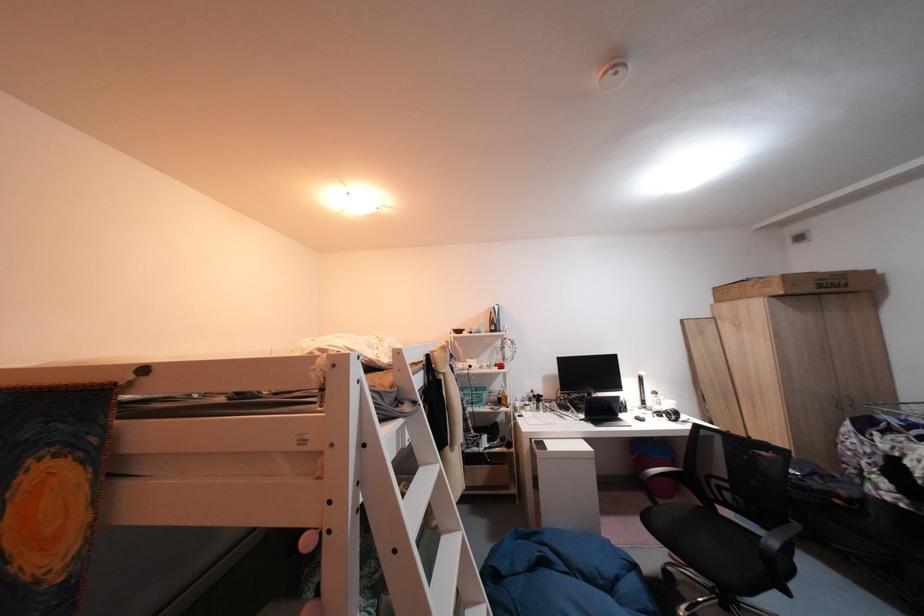
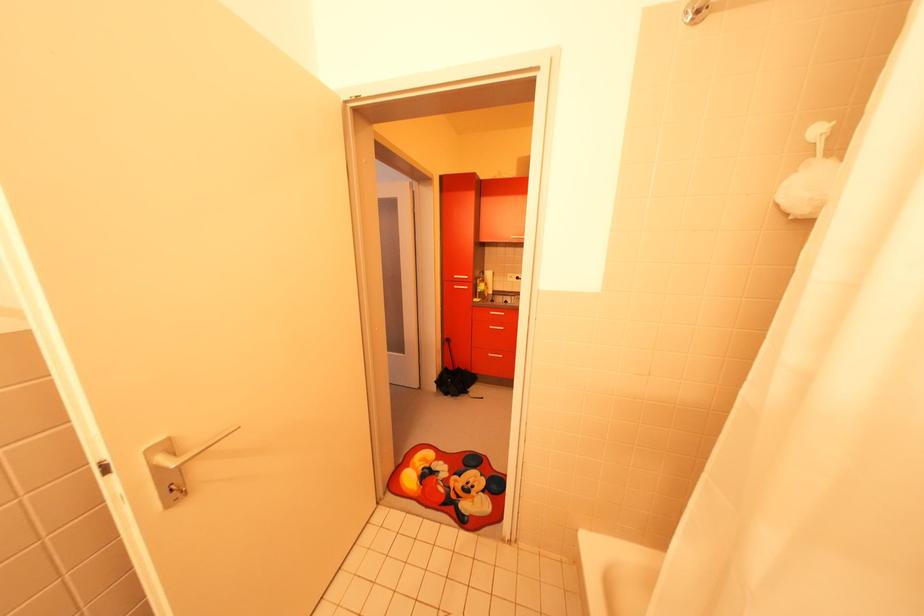
Question: I am providing you with two images of the same scene from different viewpoints. Please identify which objects are invisible in image2.

Choices:
 (A) white ladder rung
 (B) black and blue backpack
 (C) yellow bottle
 (D) silver drawer handle

Answer: (A)